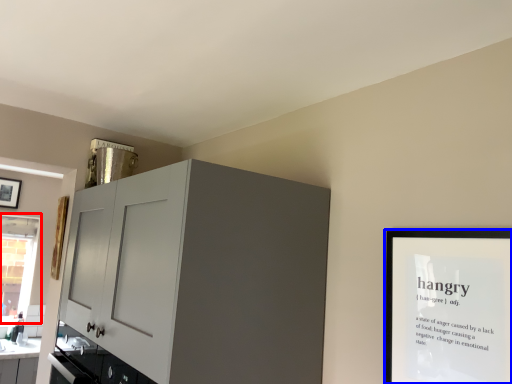
Question: Which point is closer to the camera, window (highlighted by a red box) or picture frame (highlighted by a blue box)?

Choices:
 (A) window
 (B) picture frame

Answer: (B)